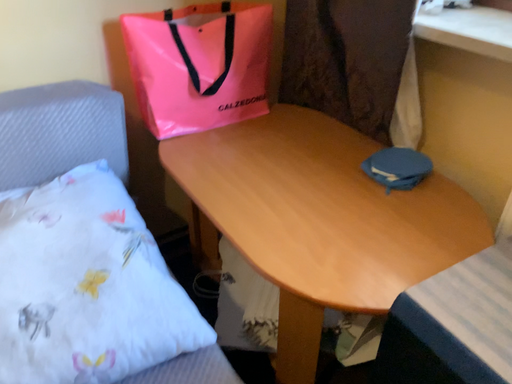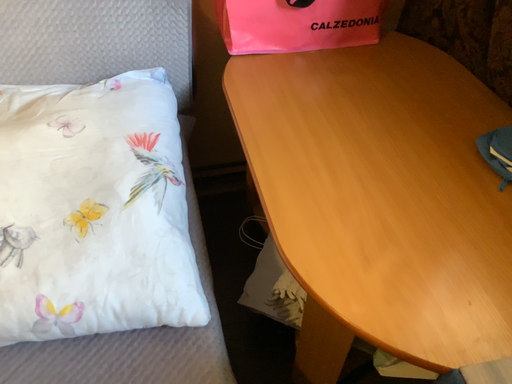
Question: Which way did the camera rotate in the video?

Choices:
 (A) rotated downward
 (B) rotated upward

Answer: (A)